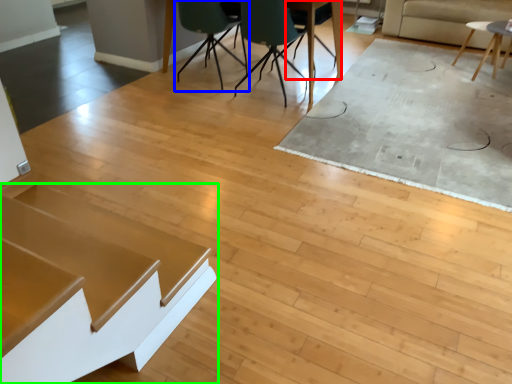
Question: Which is nearer to the chair (highlighted by a red box)? chair (highlighted by a blue box) or table (highlighted by a green box).

Choices:
 (A) chair
 (B) table

Answer: (A)